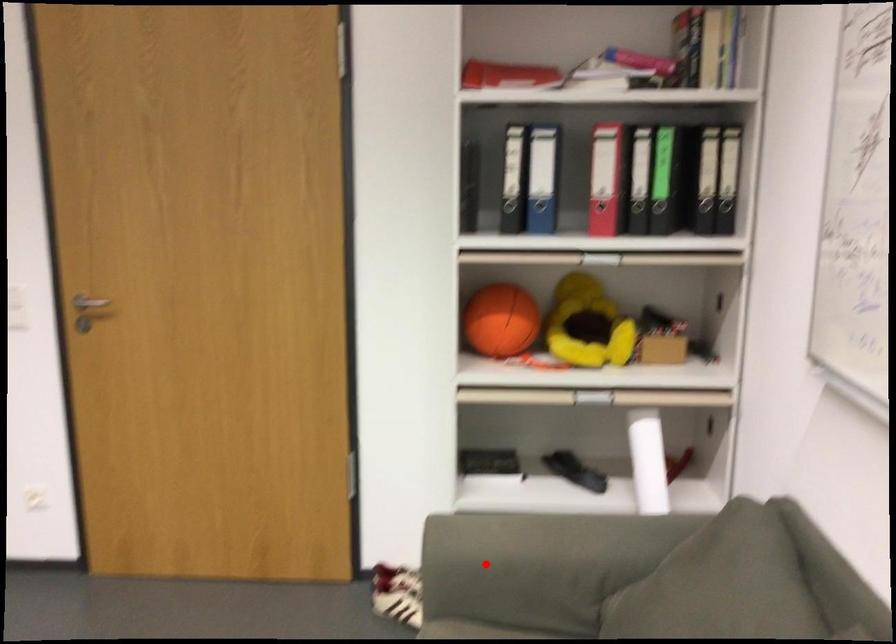
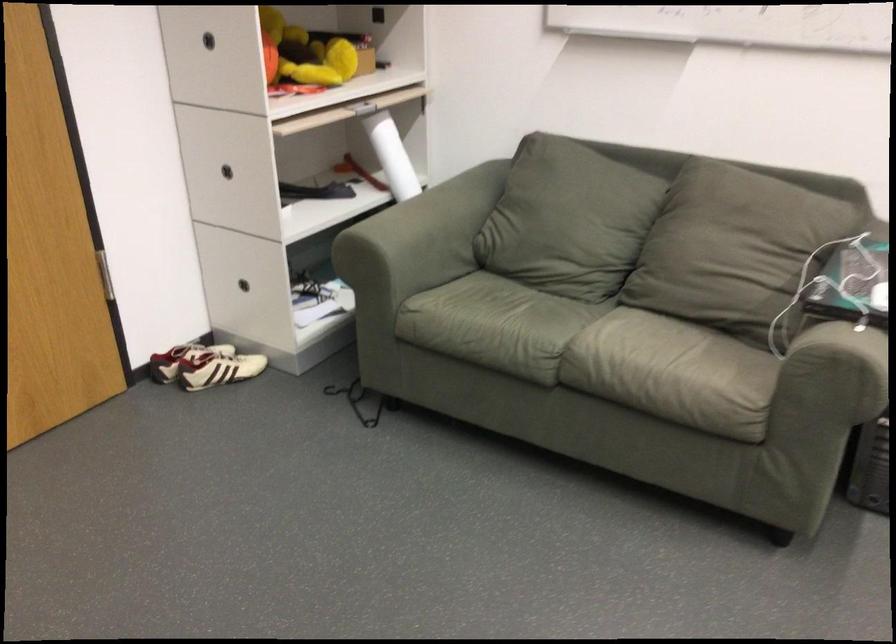
Question: I am providing you with two images of the same scene from different viewpoints. A red point is shown in image1. For the corresponding object point in image2, is it positioned nearer or farther from the camera?

Choices:
 (A) Nearer
 (B) Farther

Answer: (B)